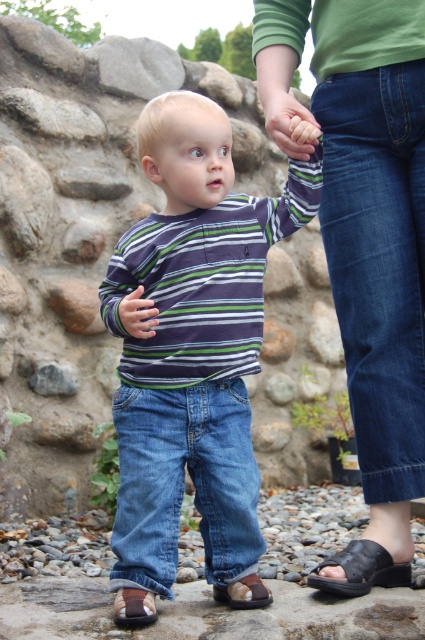
Question: Which object is the farthest from the brown leather sandal at lower center?

Choices:
 (A) matte skin hand at center
 (B) brown leather sandal at lower left
 (C) brown leather sandal at lower right
 (D) striped cotton shirt at center

Answer: (A)

Question: Which of the following is the farthest from the observer?

Choices:
 (A) matte black ring at center
 (B) brown leather sandal at lower center
 (C) matte skin hand at center
 (D) denim jeans at lower right

Answer: (B)

Question: Which of the following is the farthest from the observer?

Choices:
 (A) (354, 557)
 (B) (136, 300)
 (C) (187, 243)
 (D) (113, 545)

Answer: (A)

Question: Observing the image, what is the correct spatial positioning of green cotton shirt at upper center in reference to blue denim jeans at center?

Choices:
 (A) below
 (B) above

Answer: (B)

Question: Can you confirm if matte skin hand at center is positioned below matte black ring at center?

Choices:
 (A) no
 (B) yes

Answer: (A)

Question: Does brown leather sandal at lower left appear under matte black ring at center?

Choices:
 (A) no
 (B) yes

Answer: (B)